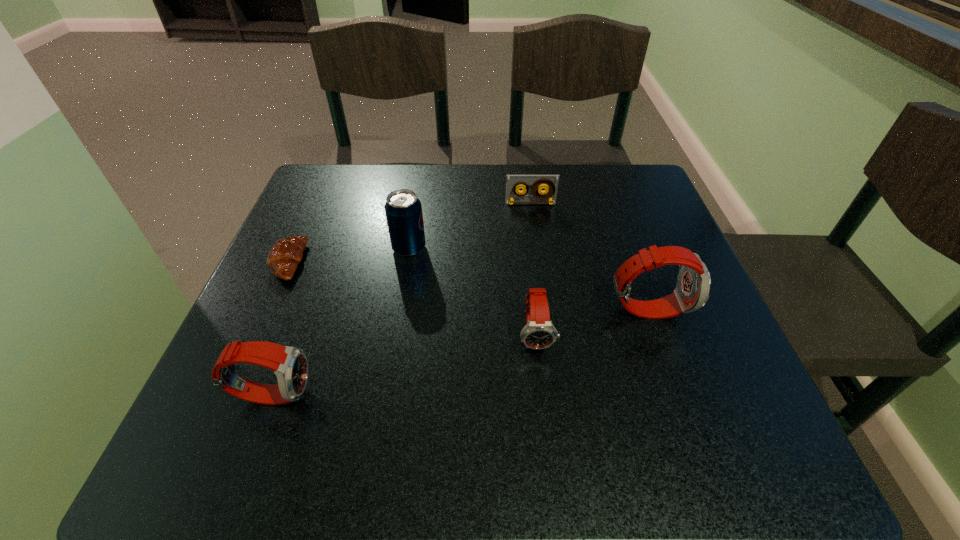
Please point a space for a new watch to maintain equal intervals. Please provide its 2D coordinates. Your answer should be formatted as a tuple, i.e. [(x, y)], where the tuple contains the x and y coordinates of a point satisfying the conditions above.

[(412, 362)]